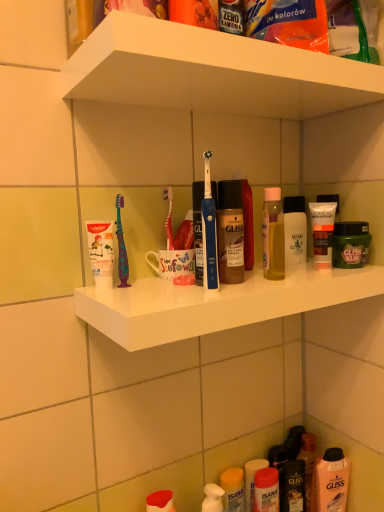
Locate an element on the screen. vacant space that's between blue plastic toothbrush at center and white matte toothpaste tube at left, placed as the first toiletry when sorted from left to right is located at coordinates (156, 291).